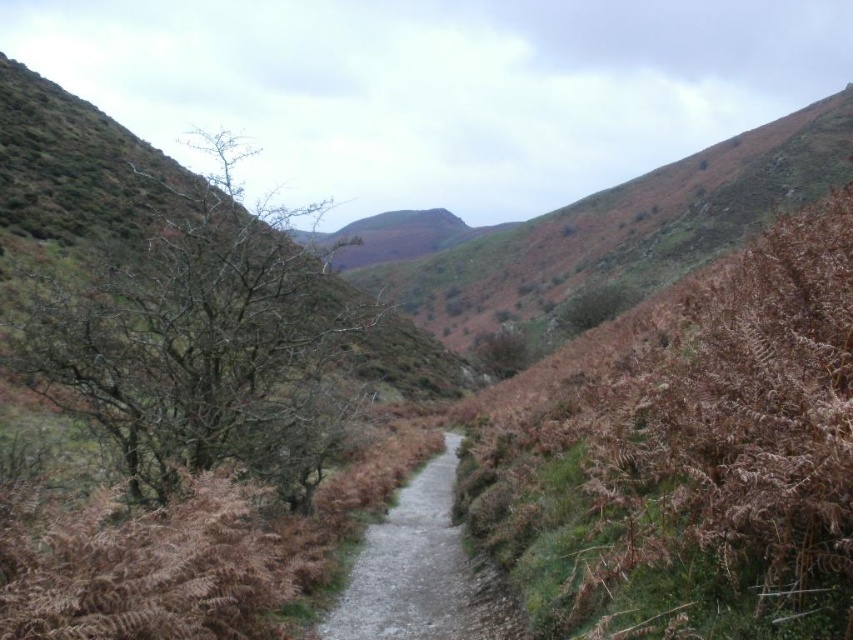
Can you confirm if bare branches at left is positioned to the left of dirt/gravel path at center?

Correct, you'll find bare branches at left to the left of dirt/gravel path at center.

Is bare branches at left taller than dirt/gravel path at center?

Yes, bare branches at left is taller than dirt/gravel path at center.

Who is more forward, (140,413) or (450,618)?

Point (140,413)

Locate an element on the screen. bare branches at left is located at coordinates (200, 342).